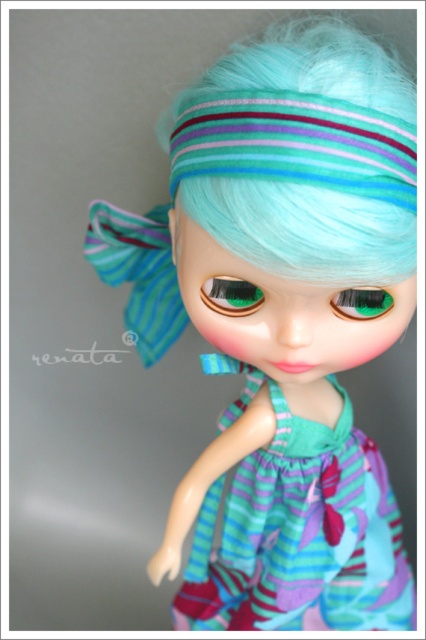
Which is in front, point (402, 554) or point (170, 193)?

Point (170, 193) is more forward.

Is point (241, 400) more distant than point (373, 93)?

Yes, point (241, 400) is behind point (373, 93).

Find the location of a particular element. This screenshot has width=426, height=640. teal striped fabric dress at center is located at coordinates (298, 531).